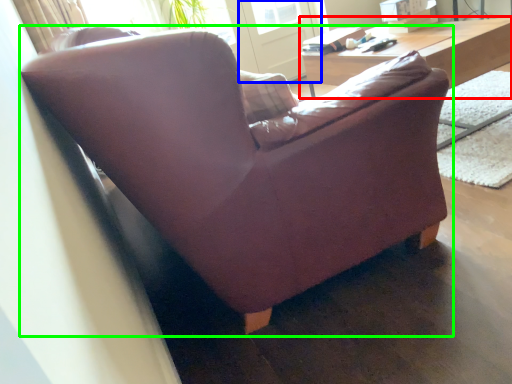
Question: Considering the real-world distances, which object is farthest from table (highlighted by a red box)? screen door (highlighted by a blue box) or studio couch (highlighted by a green box)?

Choices:
 (A) screen door
 (B) studio couch

Answer: (A)